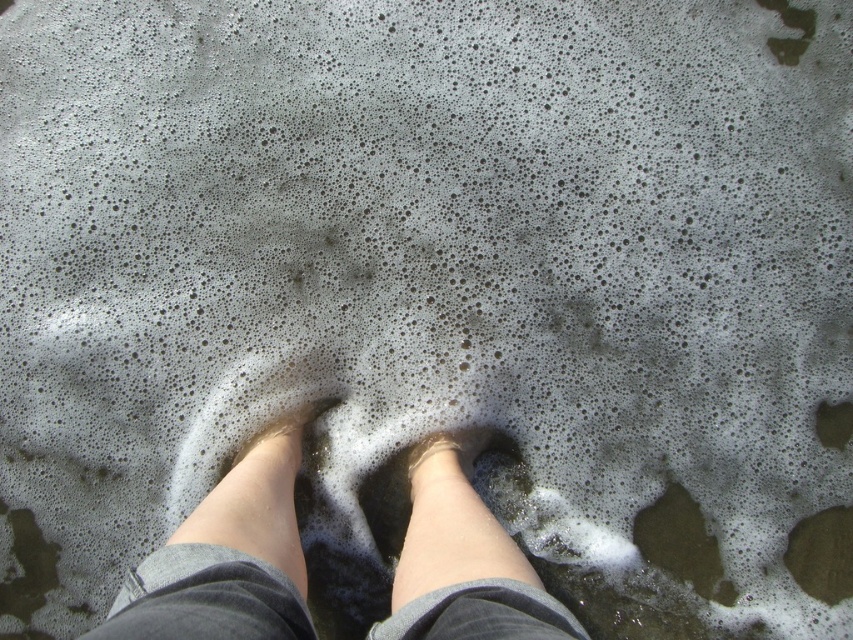
Question: Which object appears closest to the camera in this image?

Choices:
 (A) smooth tan skin at center
 (B) smooth skin legs at center

Answer: (B)

Question: Does smooth skin legs at center appear on the left side of smooth tan skin at center?

Choices:
 (A) no
 (B) yes

Answer: (B)

Question: Is smooth skin legs at center smaller than smooth tan skin at center?

Choices:
 (A) no
 (B) yes

Answer: (A)

Question: Is smooth skin legs at center to the right of smooth tan skin at center from the viewer's perspective?

Choices:
 (A) yes
 (B) no

Answer: (B)